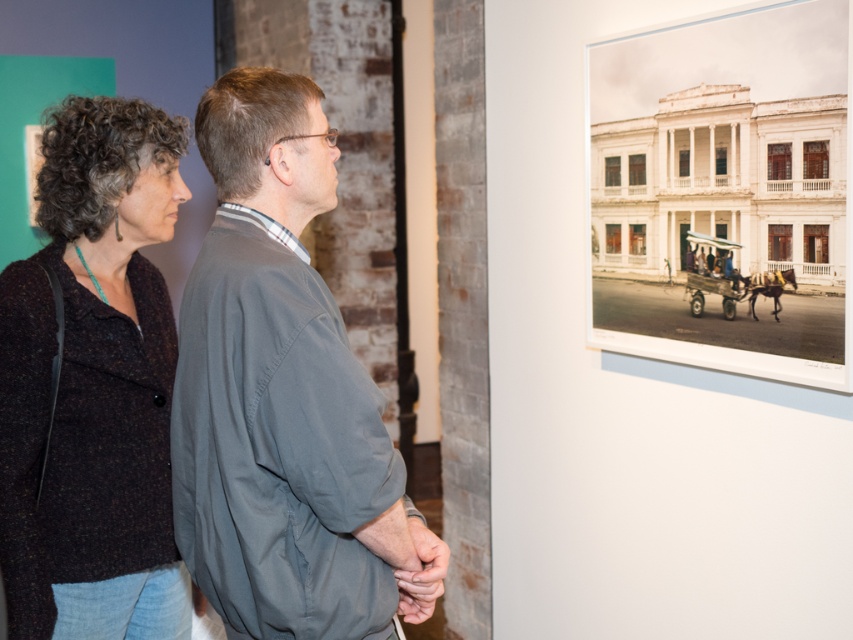
You are a fashion designer analyzing the image. You need to determine which fabric has a greater width between the gray fabric shirt at center and the dark speckled fabric at upper left. Which one is wider?

The gray fabric shirt at center has a greater width than the dark speckled fabric at upper left.

You are an interior designer assessing the fabric patterns in the room. You see the gray fabric shirt at center and the dark speckled fabric at upper left. Which fabric takes up more area in the scene?

The dark speckled fabric at upper left occupies more space than the gray fabric shirt at center.

You are standing in the room looking at the photograph. There are two points marked in the image. The first point is at coordinate point (x=294, y=552) and the second point is at coordinate point (x=3, y=342). Which point is closer to you?

Point (x=294, y=552) is closer to the viewer than point (x=3, y=342).